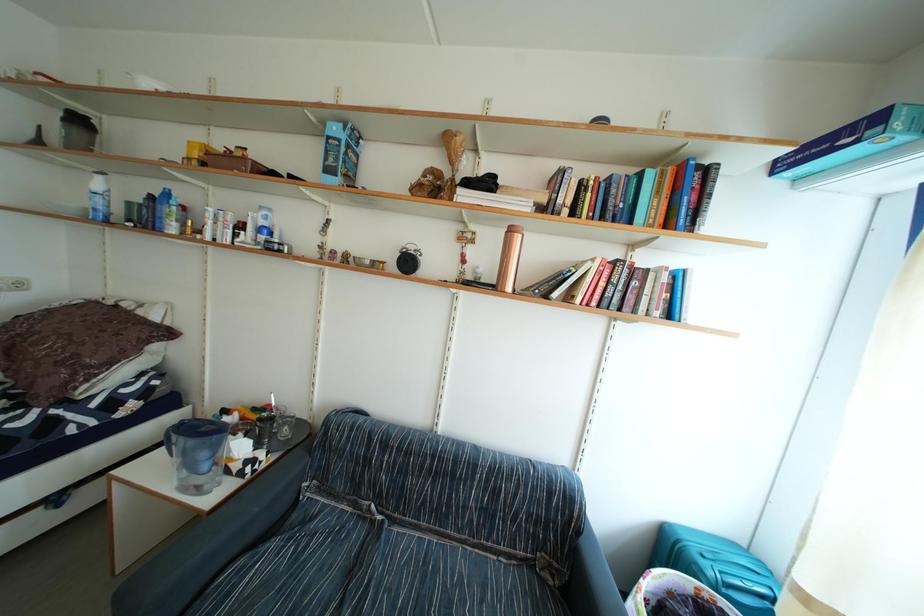
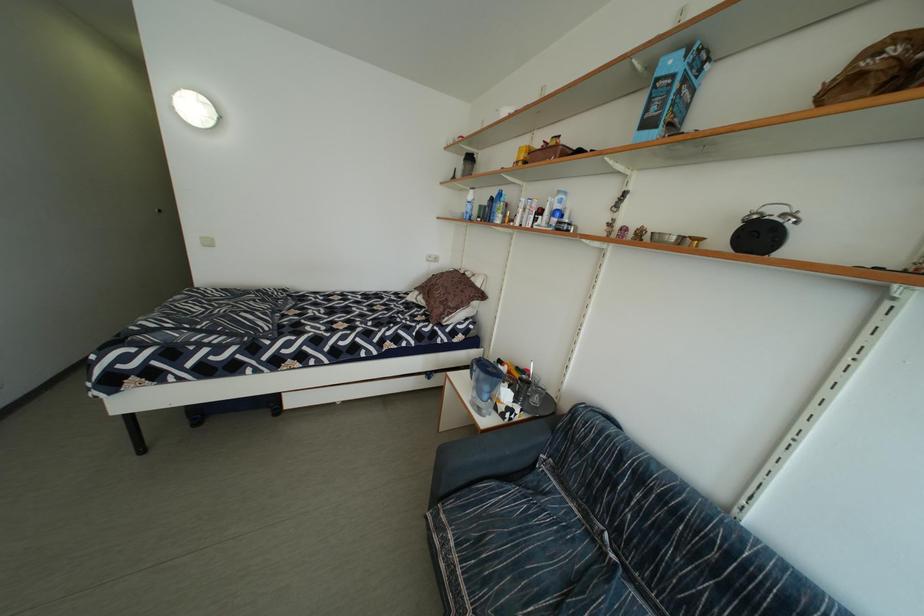
Question: The camera is either moving clockwise (left) or counter-clockwise (right) around the object. The first image is from the beginning of the video and the second image is from the end. Is the camera moving left or right when shooting the video?

Choices:
 (A) Left
 (B) Right

Answer: (B)